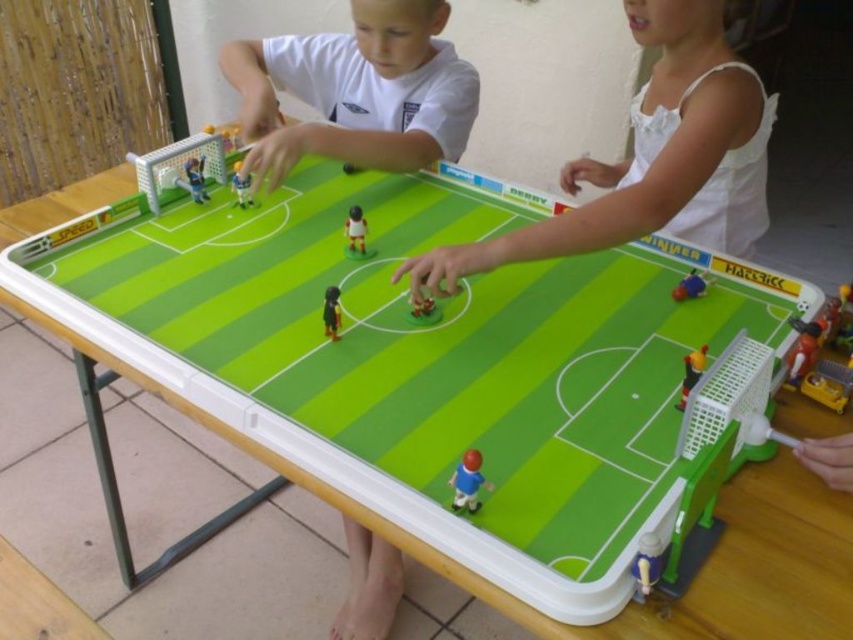
You are a referee observing the children playing a tabletop soccer game. The ball is currently at the point labeled as point (331, 312). You need to determine if the ball is within the field boundaries. Can you confirm this?

The black plastic figure at center is represented by point (331, 312), which is the ball. Since the field boundaries are marked with white lines on the green playing surface, and the ball is at the center point, it is within the field boundaries.

You are designing a new table soccer game and need to ensure that the blue matte figure at center and the shiny plastic soccer ball at center can move freely. Based on their sizes, which object might require more space to maneuver?

The blue matte figure at center might require more space to maneuver since it is wider than the shiny plastic soccer ball at center according to the description.